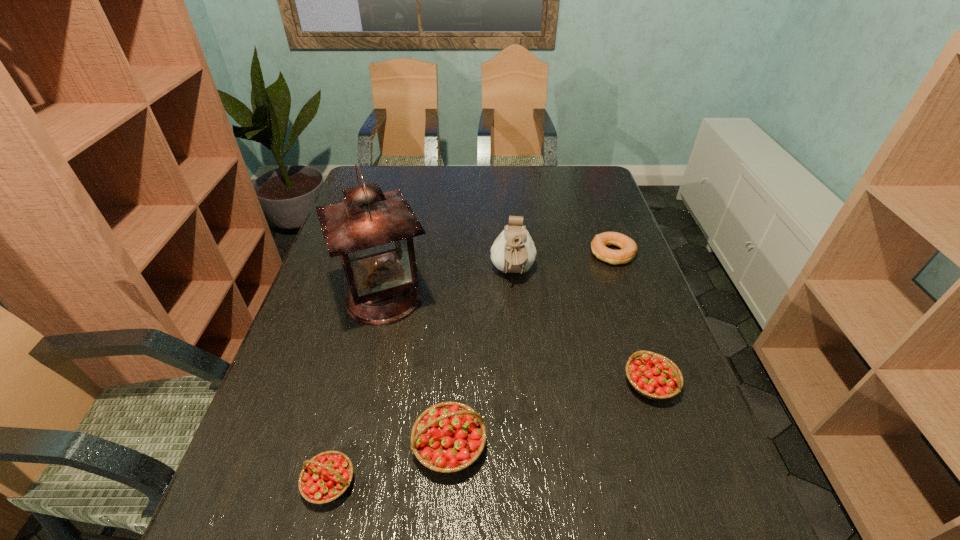
The height and width of the screenshot is (540, 960). I want to click on unoccupied area between the shortest strawberry and the oil lamp, so click(x=357, y=390).

Find the location of a particular element. This screenshot has height=540, width=960. free area in between the fifth shortest object and the tallest object is located at coordinates (448, 286).

Locate an element on the screen. This screenshot has width=960, height=540. free space between the oil lamp and the second strawberry from left to right is located at coordinates (417, 372).

You are a GUI agent. You are given a task and a screenshot of the screen. Output one action in this format:
    pyautogui.click(x=<x>, y=<y>)
    Task: Click on the empty location between the second tallest strawberry and the fifth tallest object
    This screenshot has height=540, width=960.
    Given the screenshot: What is the action you would take?
    (490, 433)

At what (x,y) coordinates should I click in order to perform the action: click on free space between the second tallest object and the second shortest strawberry. Please return your answer as a coordinate pair (x, y). This screenshot has height=540, width=960. Looking at the image, I should click on (582, 328).

Find the location of `empty space that is in between the second tallest strawberry and the fourth object from left to right`. empty space that is in between the second tallest strawberry and the fourth object from left to right is located at coordinates (582, 328).

Locate an element on the screen. object that ranks as the fifth closest to the leftmost strawberry is located at coordinates (628, 247).

Identify which object is the fourth closest to the rightmost strawberry. Please provide its 2D coordinates. Your answer should be formatted as a tuple, i.e. [(x, y)], where the tuple contains the x and y coordinates of a point satisfying the conditions above.

[(372, 231)]

Where is `strawberry that stands as the closest to the second strawberry from right to left`? This screenshot has height=540, width=960. strawberry that stands as the closest to the second strawberry from right to left is located at coordinates [325, 477].

Identify which strawberry is the second closest to the fifth shortest object. Please provide its 2D coordinates. Your answer should be formatted as a tuple, i.e. [(x, y)], where the tuple contains the x and y coordinates of a point satisfying the conditions above.

[(447, 437)]